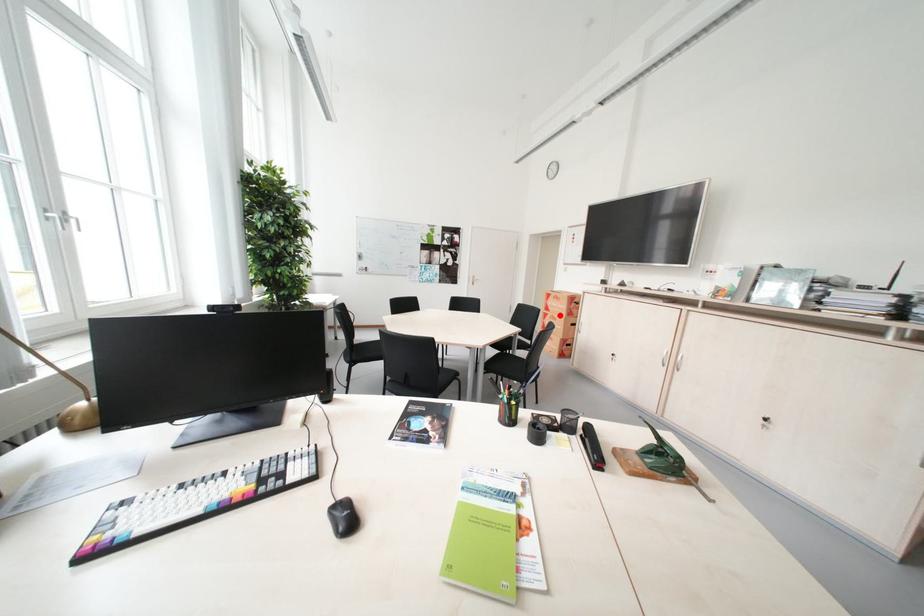
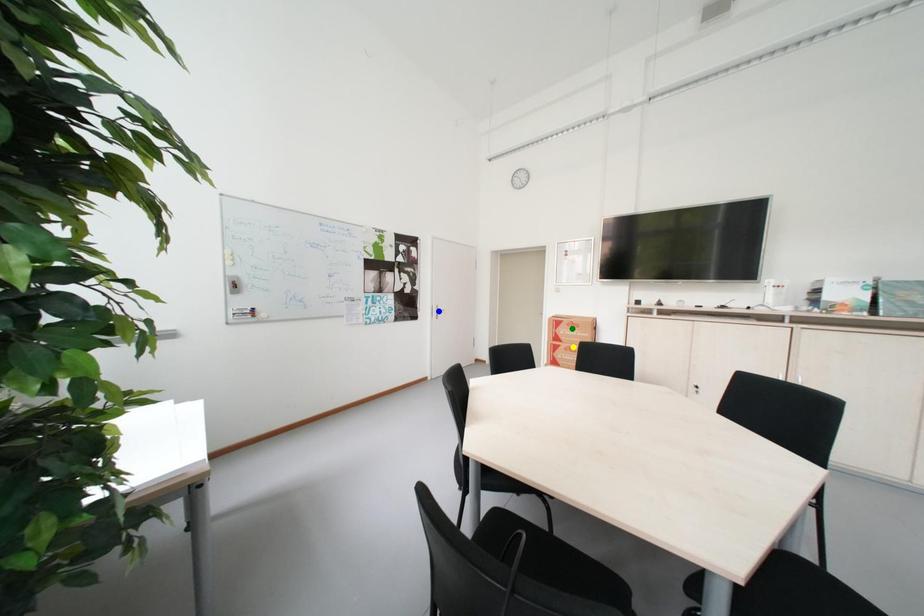
Question: I am providing you with two images of the same scene from different viewpoints. A red point is marked on the first image. You are given multiple points on the second image. Which spot in image 2 lines up with the point in image 1?

Choices:
 (A) blue point
 (B) green point
 (C) yellow point

Answer: (C)